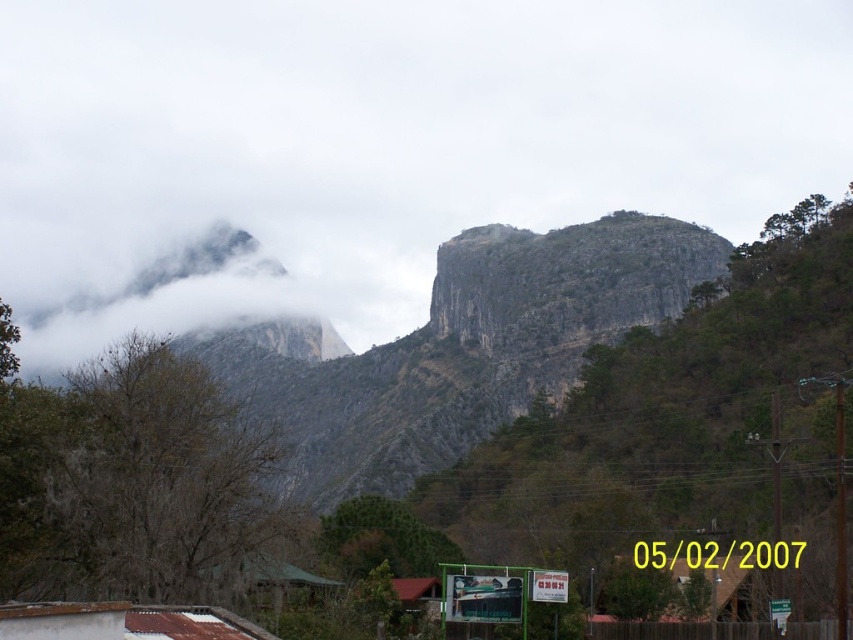
Is rugged stone mountain at upper center wider than white fluffy cloud at left?

Yes.

Is point (91, 584) closer to camera compared to point (184, 253)?

Yes, point (91, 584) is closer to viewer.

Which is behind, point (257, 384) or point (161, 268)?

Positioned behind is point (161, 268).

Where is `rugged stone mountain at upper center`? Image resolution: width=853 pixels, height=640 pixels. rugged stone mountain at upper center is located at coordinates (283, 420).